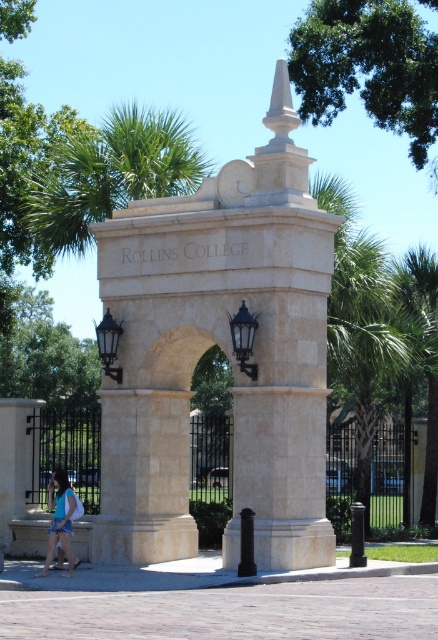
Is green leafy tree at upper center thinner than green leafy palm tree at upper left?

No.

Does point (335, 86) come closer to viewer compared to point (92, 193)?

No, it is not.

Find the location of a particular element. The width and height of the screenshot is (438, 640). green leafy tree at upper center is located at coordinates (367, 67).

Can you confirm if beige stone arch at center is wider than green leafy palm tree at upper left?

No.

Does point (159, 429) come in front of point (134, 134)?

Yes, point (159, 429) is in front of point (134, 134).

I want to click on beige stone arch at center, so click(x=225, y=353).

Which is more to the left, beige stone arch at center or green leafy tree at upper center?

beige stone arch at center

Does beige stone arch at center appear on the right side of green leafy tree at upper center?

In fact, beige stone arch at center is to the left of green leafy tree at upper center.

Describe the element at coordinates (225, 353) in the screenshot. I see `beige stone arch at center` at that location.

Identify the location of beige stone arch at center. This screenshot has height=640, width=438. (225, 353).